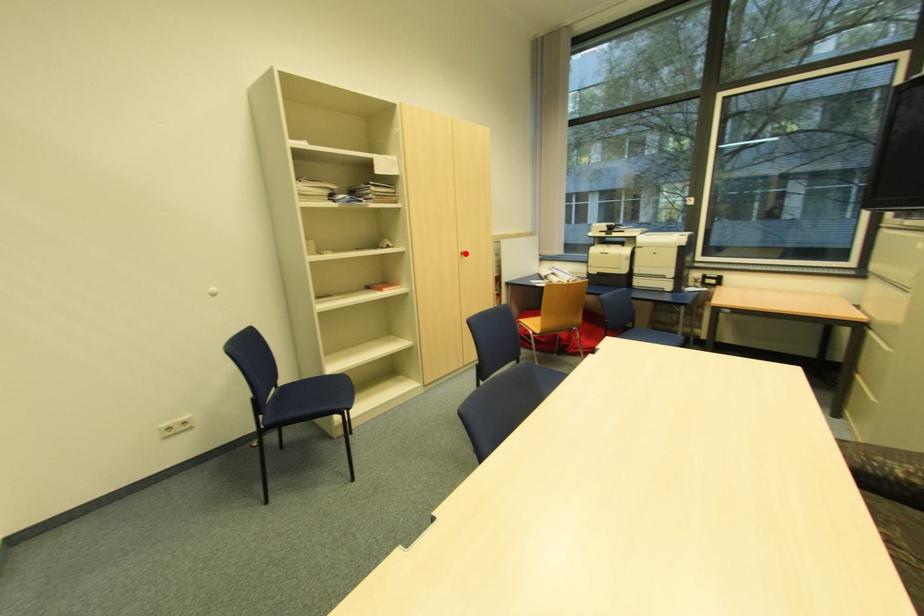
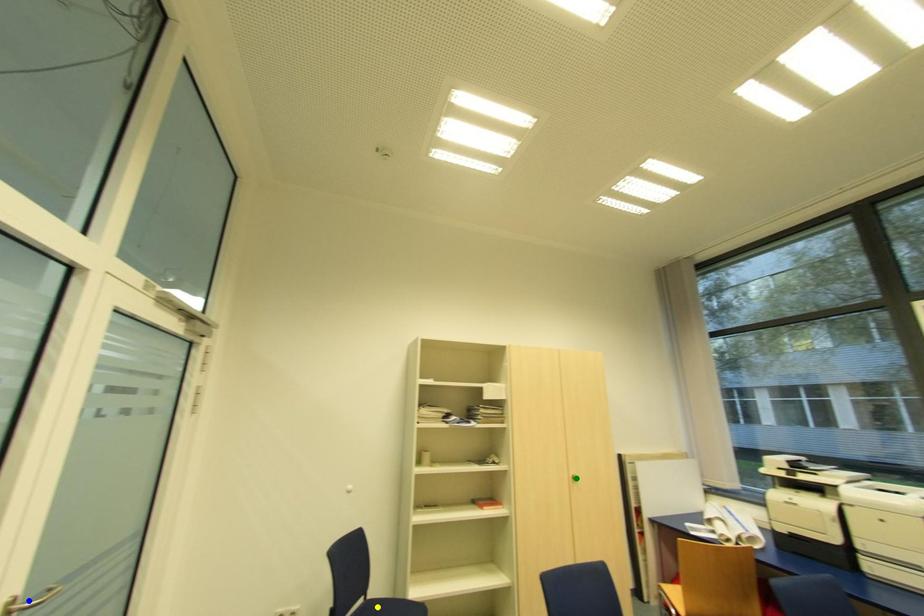
Question: I am providing you with two images of the same scene from different viewpoints. A red point is marked on the first image. You are given multiple points on the second image. Which point in image 2 is actually the same real-world point as the red point in image 1?

Choices:
 (A) green point
 (B) blue point
 (C) yellow point

Answer: (A)